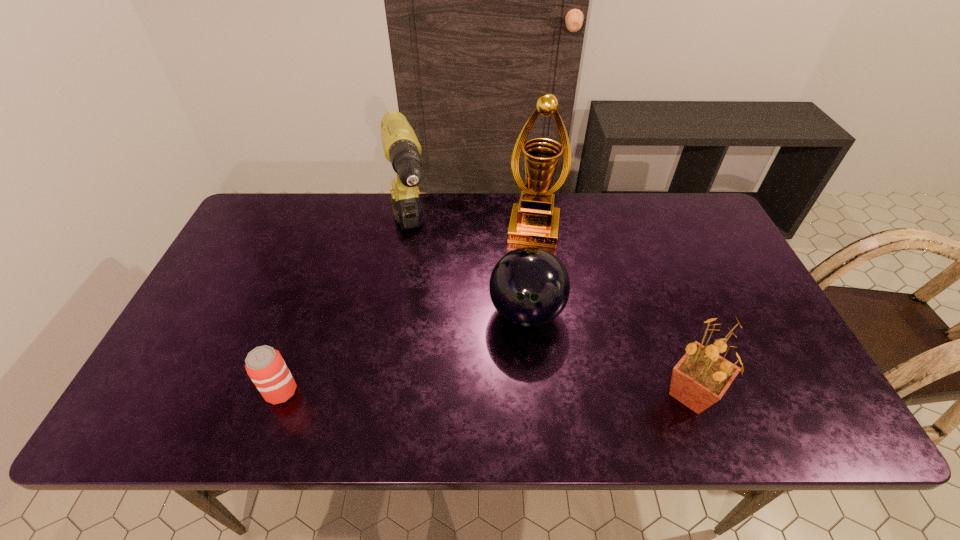
Image resolution: width=960 pixels, height=540 pixels. Find the location of `vacant space located 0.090m on the side of the fourth tallest object with the finger holes`. vacant space located 0.090m on the side of the fourth tallest object with the finger holes is located at coordinates (532, 376).

You are a GUI agent. You are given a task and a screenshot of the screen. Output one action in this format:
    pyautogui.click(x=<x>, y=<y>)
    Task: Click on the free space located on the side of the fourth tallest object with the finger holes
    
    Given the screenshot: What is the action you would take?
    pyautogui.click(x=532, y=372)

At what (x,y) coordinates should I click in order to perform the action: click on drill that is positioned at the far edge. Please return your answer as a coordinate pair (x, y). Looking at the image, I should click on (401, 147).

Identify the location of award that is at the far edge. (534, 220).

Locate an element on the screen. Image resolution: width=960 pixels, height=540 pixels. beer can at the near edge is located at coordinates (265, 366).

Image resolution: width=960 pixels, height=540 pixels. Identify the location of sunflower present at the near edge. (702, 376).

Where is `free space at the far edge`? Image resolution: width=960 pixels, height=540 pixels. free space at the far edge is located at coordinates click(375, 223).

Image resolution: width=960 pixels, height=540 pixels. In the image, there is a desktop. Find the location of `vacant space at the near edge`. vacant space at the near edge is located at coordinates (381, 390).

Identify the location of blank space at the right edge. The image size is (960, 540). (722, 242).

Where is `vacant space at the far left corner`? This screenshot has width=960, height=540. vacant space at the far left corner is located at coordinates (285, 221).